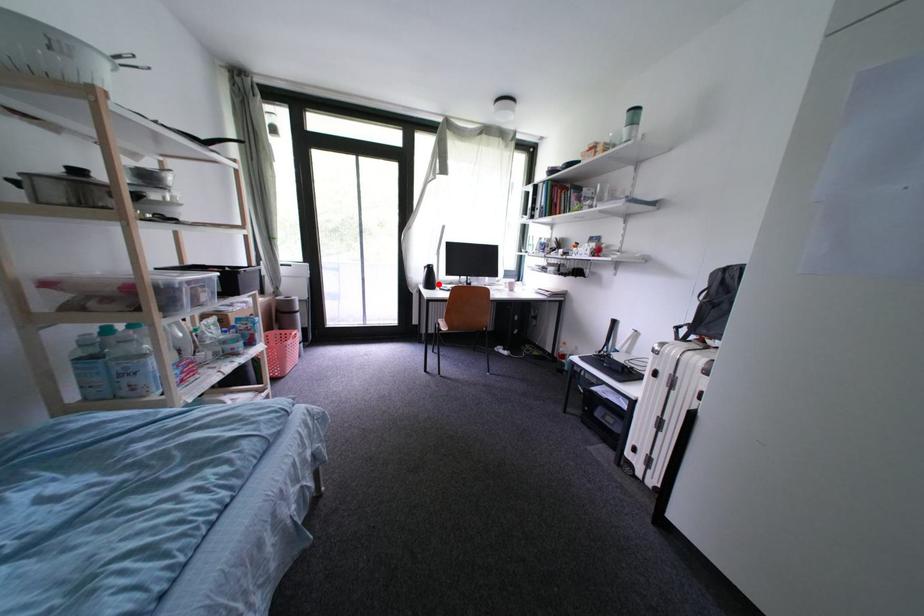
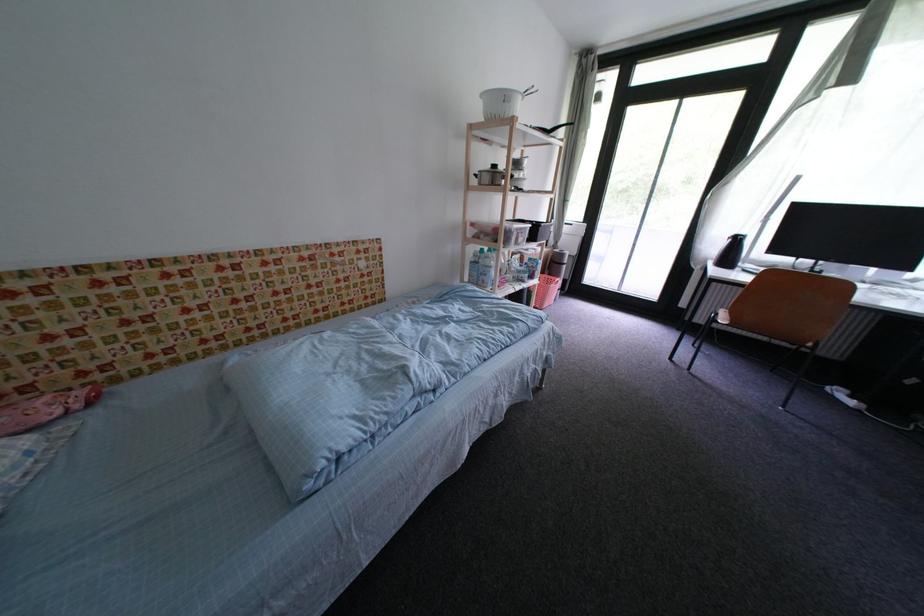
Question: I am providing you with two images of the same scene from different viewpoints. Image1 has a red point marked. In image2, the corresponding 3D location appears at what relative position? Reply with the corresponding letter.

Choices:
 (A) Closer
 (B) Farther

Answer: (B)